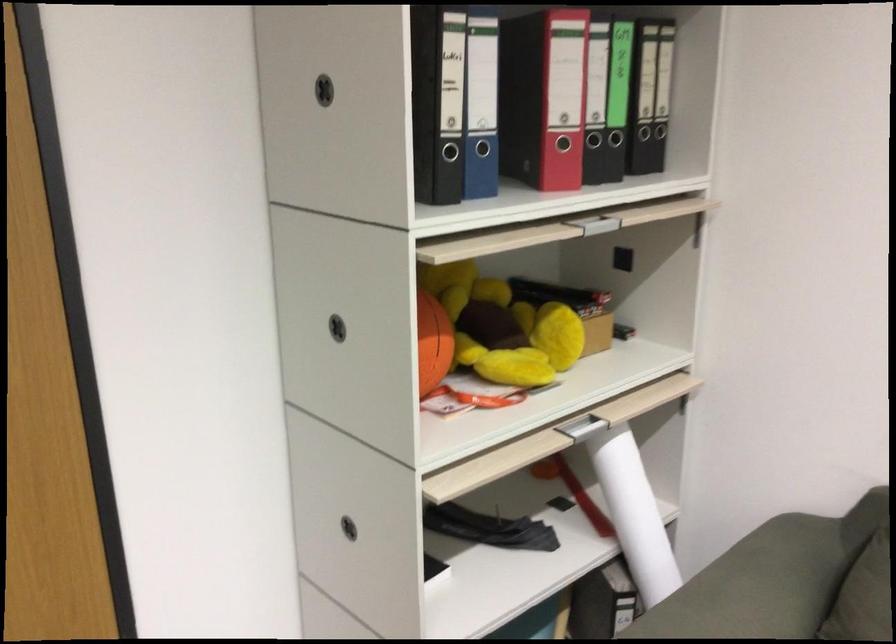
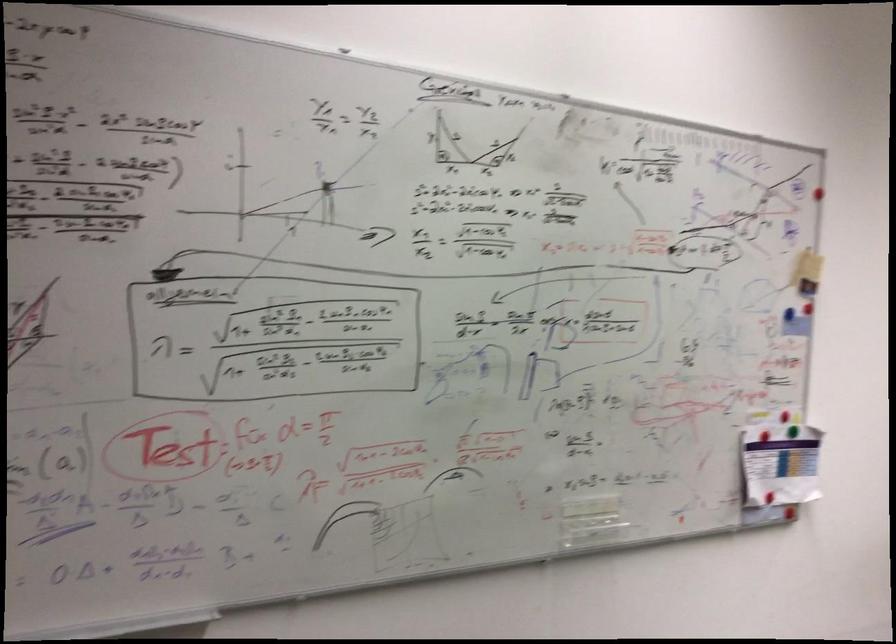
Question: The camera is either moving clockwise (left) or counter-clockwise (right) around the object. The first image is from the beginning of the video and the second image is from the end. Is the camera moving left or right when shooting the video?

Choices:
 (A) Left
 (B) Right

Answer: (A)